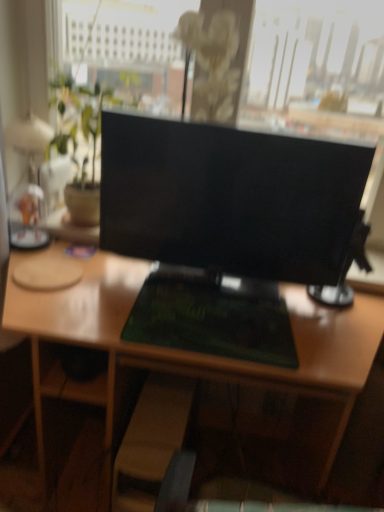
The image size is (384, 512). I want to click on free point above wooden swivel chair at lower center (from a real-world perspective), so click(x=150, y=421).